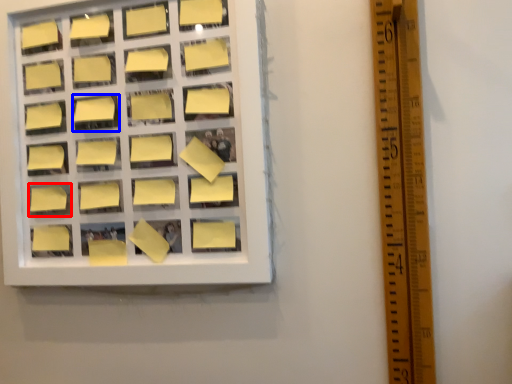
Question: Which point is closer to the camera, square (highlighted by a red box) or square (highlighted by a blue box)?

Choices:
 (A) square
 (B) square

Answer: (B)